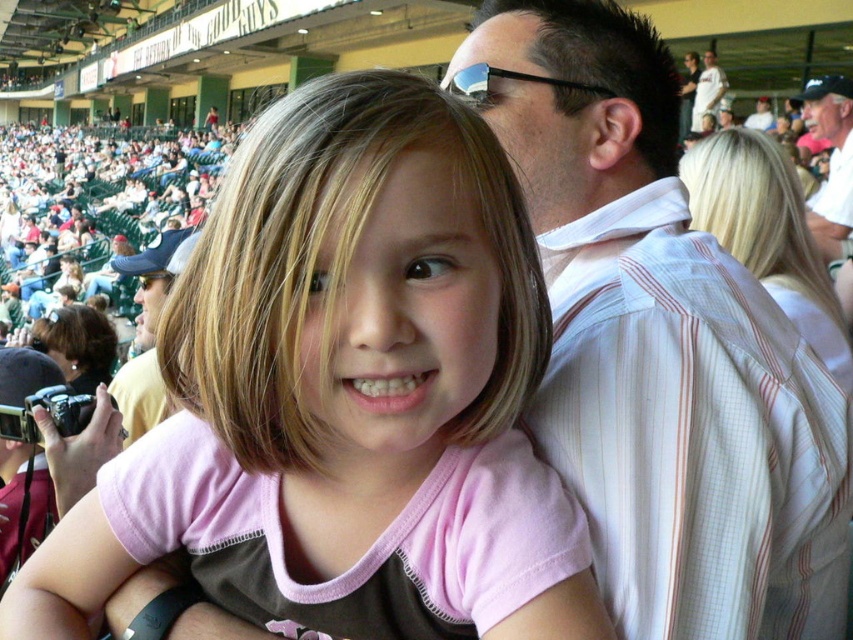
You are a photographer at the baseball stadium and want to capture a photo that includes both the pink fabric shirt at center and the white striped shirt at upper right. Based on their positions, which shirt should you adjust your camera to focus on first to ensure both are in the frame?

The pink fabric shirt at center is to the left of the white striped shirt at upper right, so you should focus on the white striped shirt at upper right first to ensure both shirts are captured in the frame.

You are a photographer at the baseball stadium and want to capture both the white striped shirt at upper right and the white pinstriped shirt at upper right in your shot. Which shirt should you focus on to ensure the other fits into the frame?

The white pinstriped shirt at upper right takes up more space, so focusing on the white striped shirt at upper right first would allow the larger white pinstriped shirt at upper right to fit into the frame.